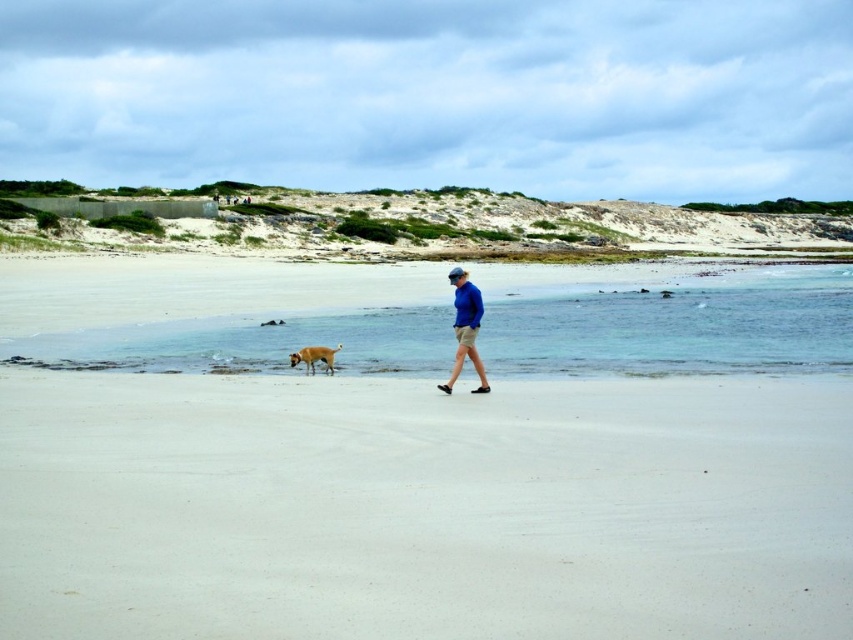
Question: Estimate the real-world distances between objects in this image. Which object is closer to the white sand at center?

Choices:
 (A) blue cotton shirt at center
 (B) golden fur dog at center

Answer: (A)

Question: Observing the image, what is the correct spatial positioning of blue cotton shirt at center in reference to golden fur dog at center?

Choices:
 (A) above
 (B) below

Answer: (A)

Question: Can you confirm if white sand at center is positioned to the right of golden fur dog at center?

Choices:
 (A) yes
 (B) no

Answer: (A)

Question: Which point is farther to the camera?

Choices:
 (A) (640, 582)
 (B) (311, 369)
 (C) (462, 330)

Answer: (B)

Question: Is blue cotton shirt at center thinner than golden fur dog at center?

Choices:
 (A) yes
 (B) no

Answer: (A)

Question: Based on their relative distances, which object is nearer to the white sand at center?

Choices:
 (A) golden fur dog at center
 (B) blue cotton shirt at center

Answer: (B)